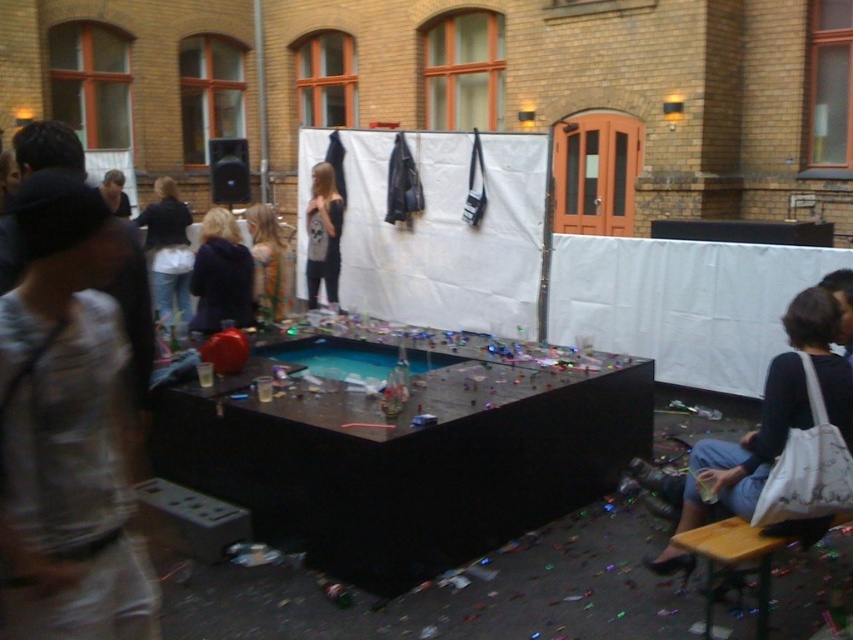
Question: Considering the real-world distances, which object is closest to the white fabric bag at lower right?

Choices:
 (A) shiny gold hair at center
 (B) denim jacket at center

Answer: (A)

Question: Estimate the real-world distances between objects in this image. Which object is closer to the dark blue sweater at center?

Choices:
 (A) denim jacket at center
 (B) matte gray sweater at center

Answer: (B)

Question: Can you confirm if denim jacket at center is positioned below matte gray sweater at center?

Choices:
 (A) no
 (B) yes

Answer: (B)

Question: Observing the image, what is the correct spatial positioning of dark blue sweater at center in reference to shiny gold hair at center?

Choices:
 (A) right
 (B) left

Answer: (B)

Question: Does dark blue sweater at center have a lesser width compared to shiny gold hair at center?

Choices:
 (A) no
 (B) yes

Answer: (A)

Question: Which object is farther from the camera taking this photo?

Choices:
 (A) denim jacket at center
 (B) white fabric bag at lower right
 (C) shiny gold hair at center

Answer: (A)